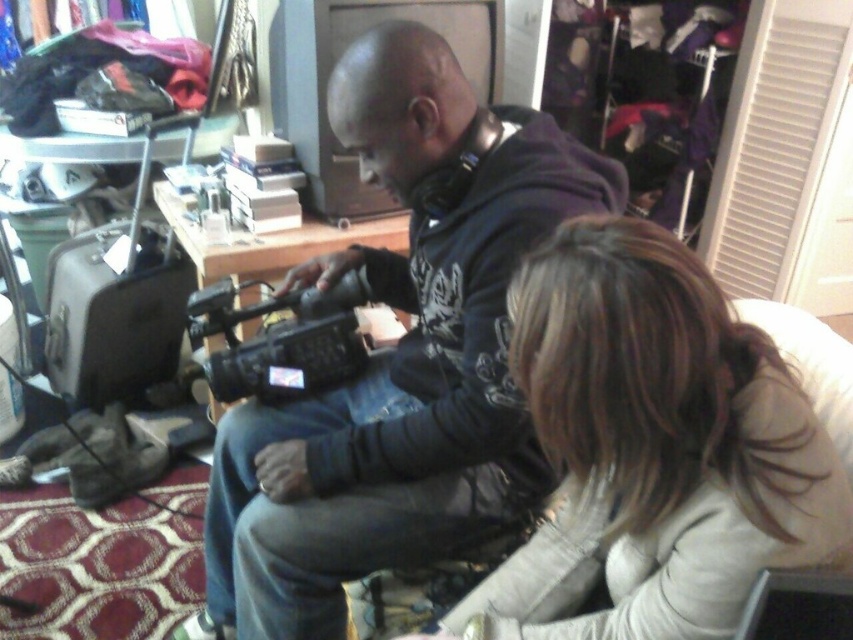
You are organizing a photography workshop and need to place the matte black camera at center and the smooth beige sweater at lower right into a storage box. The box can only accommodate items that are smaller than the camera. Which item should you prioritize placing first to ensure both fit?

The smooth beige sweater at lower right should be placed first since it is smaller than the matte black camera at center, allowing both items to fit into the storage box.

You are a photographer trying to adjust your setup. You need to move the matte black camera at center closer to the smooth beige sweater at lower right. Which direction should you move it?

Since the matte black camera at center is further to the viewer than the smooth beige sweater at lower right, you should move it forward towards the sweater to bring them closer together.

You are organizing a small event and need to place the smooth beige sweater at lower right and the black plastic video camera at center on a shelf. If the shelf can only hold items up to the size of the camera, will the sweater fit?

The smooth beige sweater at lower right is wider than the black plastic video camera at center, so it won not fit on the shelf if the shelf can only hold items up to the size of the camera.